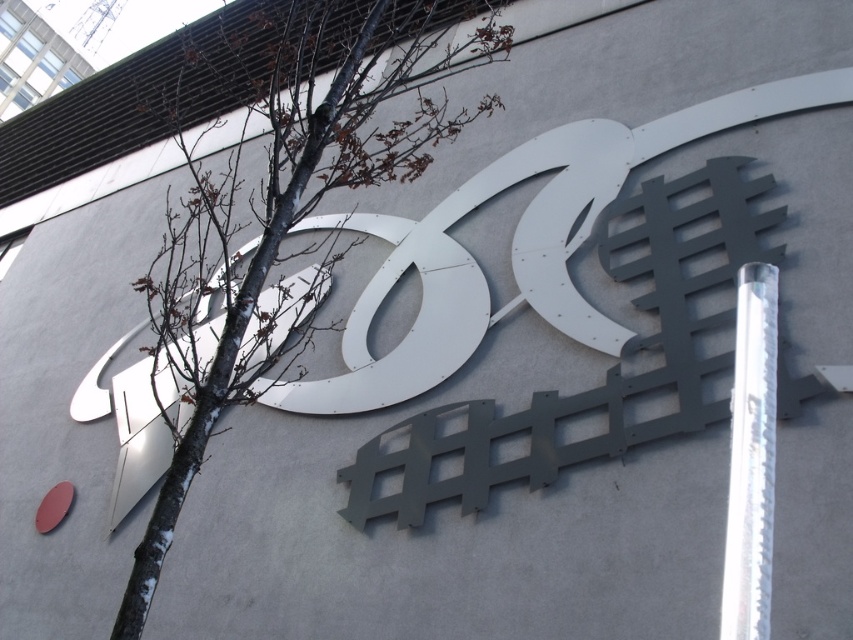
Question: Where is bare wood tree at center located in relation to silver metallic pole at right in the image?

Choices:
 (A) above
 (B) below

Answer: (A)

Question: Is bare wood tree at center positioned in front of silver metallic pole at right?

Choices:
 (A) no
 (B) yes

Answer: (A)

Question: Which point appears farthest from the camera in this image?

Choices:
 (A) (146, 564)
 (B) (759, 291)

Answer: (A)

Question: Among these points, which one is nearest to the camera?

Choices:
 (A) (752, 330)
 (B) (363, 168)

Answer: (A)

Question: Does bare wood tree at center appear under silver metallic pole at right?

Choices:
 (A) yes
 (B) no

Answer: (B)